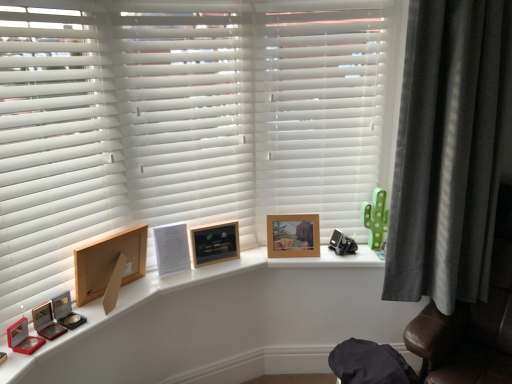
Question: Should I look upward or downward to see white matte shutter at left, which ranks as the 3th shutter in right-to-left order?

Choices:
 (A) down
 (B) up

Answer: (B)

Question: Does white matte blinds at center, acting as the 2th shutter starting from the right, have a larger size compared to dark grey velvet curtain at right?

Choices:
 (A) no
 (B) yes

Answer: (A)

Question: Is white matte blinds at center, acting as the 2th shutter starting from the right, at the left side of dark grey velvet curtain at right?

Choices:
 (A) yes
 (B) no

Answer: (A)

Question: From the image's perspective, is white matte blinds at center, acting as the 2th shutter starting from the left, below dark grey velvet curtain at right?

Choices:
 (A) yes
 (B) no

Answer: (B)

Question: From a real-world perspective, is white matte blinds at center, acting as the 2th shutter starting from the right, located beneath dark grey velvet curtain at right?

Choices:
 (A) yes
 (B) no

Answer: (B)

Question: From the image's perspective, is white matte blinds at center, acting as the 2th shutter starting from the left, above dark grey velvet curtain at right?

Choices:
 (A) no
 (B) yes

Answer: (B)

Question: Is white matte blinds at center, acting as the 2th shutter starting from the right, surrounding dark grey velvet curtain at right?

Choices:
 (A) no
 (B) yes

Answer: (A)

Question: Is wooden picture frame at left, which is the third picture frame from right to left, touching wooden frame at upper center?

Choices:
 (A) no
 (B) yes

Answer: (A)

Question: From the image's perspective, does wooden picture frame at left, which is the third picture frame from back to front, appear lower than wooden frame at upper center?

Choices:
 (A) no
 (B) yes

Answer: (A)

Question: Is wooden picture frame at left, which is the third picture frame from right to left, positioned far away from wooden frame at upper center?

Choices:
 (A) no
 (B) yes

Answer: (A)

Question: From a real-world perspective, is wooden picture frame at left, which is counted as the first picture frame, starting from the front, located beneath wooden frame at upper center?

Choices:
 (A) yes
 (B) no

Answer: (B)

Question: Is wooden picture frame at left, which is the third picture frame from right to left, bigger than wooden frame at upper center?

Choices:
 (A) yes
 (B) no

Answer: (B)

Question: Can you confirm if wooden picture frame at left, which appears as the 1th picture frame when viewed from the left, is smaller than wooden frame at upper center?

Choices:
 (A) yes
 (B) no

Answer: (A)

Question: From the image's perspective, does wooden frame at upper center appear lower than dark grey velvet curtain at right?

Choices:
 (A) yes
 (B) no

Answer: (A)